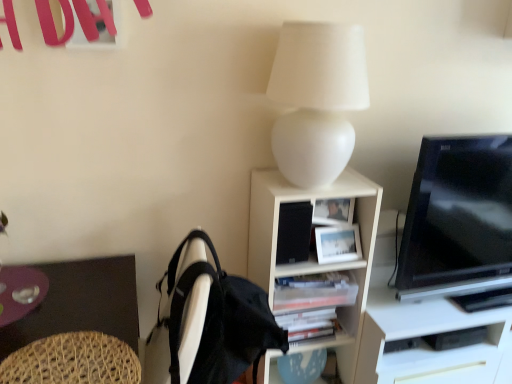
What do you see at coordinates (81, 303) in the screenshot?
I see `brown woven desk at lower left` at bounding box center [81, 303].

The width and height of the screenshot is (512, 384). What do you see at coordinates (218, 320) in the screenshot?
I see `black fabric backpack at lower left` at bounding box center [218, 320].

What do you see at coordinates (294, 232) in the screenshot? The height and width of the screenshot is (384, 512). I see `black matte speaker at center` at bounding box center [294, 232].

This screenshot has height=384, width=512. In order to click on transparent glass plate at lower left in this screenshot , I will do `click(20, 292)`.

This screenshot has width=512, height=384. Describe the element at coordinates (314, 253) in the screenshot. I see `white matte shelf at center` at that location.

Where is `brown woven desk at lower left`? The image size is (512, 384). brown woven desk at lower left is located at coordinates (81, 303).

Is black matte speaker at center at the left side of black fabric backpack at lower left?

No, black matte speaker at center is not to the left of black fabric backpack at lower left.

How different are the orientations of black matte speaker at center and black fabric backpack at lower left in degrees?

The angular difference between black matte speaker at center and black fabric backpack at lower left is 87.3 degrees.

Between black matte speaker at center and black fabric backpack at lower left, which one has larger width?

black fabric backpack at lower left is wider.

Is point (295, 212) closer or farther from the camera than point (276, 347)?

Point (295, 212) is positioned farther from the camera compared to point (276, 347).

From a real-world perspective, is white matte shelf at center located higher than black fabric backpack at lower left?

Actually, white matte shelf at center is physically below black fabric backpack at lower left in the real world.

Can you confirm if white matte shelf at center is shorter than black fabric backpack at lower left?

In fact, white matte shelf at center may be taller than black fabric backpack at lower left.

Looking at this image, considering the relative sizes of white matte shelf at center and black fabric backpack at lower left in the image provided, is white matte shelf at center wider than black fabric backpack at lower left?

No, white matte shelf at center is not wider than black fabric backpack at lower left.

The height and width of the screenshot is (384, 512). What are the coordinates of `shelf below the black fabric backpack at lower left (from a real-world perspective)` in the screenshot? It's located at (314, 253).

Is brown woven desk at lower left at the back of black fabric backpack at lower left?

Yes, brown woven desk at lower left is at the back of black fabric backpack at lower left.

Can you tell me how much black fabric backpack at lower left and brown woven desk at lower left differ in facing direction?

They differ by 86.5 degrees in their facing directions.

Is black fabric backpack at lower left far away from brown woven desk at lower left?

Actually, black fabric backpack at lower left and brown woven desk at lower left are a little close together.

Can you confirm if black fabric backpack at lower left is thinner than brown woven desk at lower left?

Yes, black fabric backpack at lower left is thinner than brown woven desk at lower left.

From a real-world perspective, which is physically below, transparent glass plate at lower left or black glossy tv at right?

transparent glass plate at lower left is physically lower.

Is transparent glass plate at lower left not close to black glossy tv at right?

Yes, transparent glass plate at lower left and black glossy tv at right are located far from each other.

Is transparent glass plate at lower left surrounding black glossy tv at right?

Definitely not — black glossy tv at right is not inside transparent glass plate at lower left.

How different are the orientations of transparent glass plate at lower left and black glossy tv at right in degrees?

transparent glass plate at lower left and black glossy tv at right are facing 1.37 degrees away from each other.

Choose the correct answer: Is brown woven desk at lower left inside woven wood swivel chair at lower left or outside it?

brown woven desk at lower left is outside woven wood swivel chair at lower left.

Considering the positions of points (2, 339) and (42, 339), is point (2, 339) closer to camera compared to point (42, 339)?

No, it is behind (42, 339).

From a real-world perspective, relative to woven wood swivel chair at lower left, is brown woven desk at lower left vertically above or below?

Clearly, from a real-world perspective, brown woven desk at lower left is below woven wood swivel chair at lower left.

Looking at this image, would you say brown woven desk at lower left is a long distance from woven wood swivel chair at lower left?

That's not correct — brown woven desk at lower left is a little close to woven wood swivel chair at lower left.

The image size is (512, 384). Identify the location of swivel chair that is under the black glossy tv at right (from a real-world perspective). (73, 361).

Which object is positioned more to the left, woven wood swivel chair at lower left or black glossy tv at right?

From the viewer's perspective, woven wood swivel chair at lower left appears more on the left side.

From a real-world perspective, which is physically below, woven wood swivel chair at lower left or black glossy tv at right?

woven wood swivel chair at lower left is physically lower.

From the image's perspective, is woven wood swivel chair at lower left on black fabric backpack at lower left?

Yes, from the image's perspective, woven wood swivel chair at lower left is on top of black fabric backpack at lower left.

Is the surface of woven wood swivel chair at lower left in direct contact with black fabric backpack at lower left?

No, woven wood swivel chair at lower left is not in contact with black fabric backpack at lower left.

Is the position of woven wood swivel chair at lower left less distant than that of black fabric backpack at lower left?

Yes, it is in front of black fabric backpack at lower left.

The width and height of the screenshot is (512, 384). What are the coordinates of `speaker behind the black fabric backpack at lower left` in the screenshot? It's located at tap(294, 232).

Where is `backpack lying on the left of white matte shelf at center`? backpack lying on the left of white matte shelf at center is located at coordinates (218, 320).

Looking at the image, which one is located further to black fabric backpack at lower left, transparent glass plate at lower left or black glossy tv at right?

Based on the image, black glossy tv at right appears to be further to black fabric backpack at lower left.

When comparing their distances from black glossy tv at right, does woven wood swivel chair at lower left or white matte shelf at center seem closer?

white matte shelf at center lies closer to black glossy tv at right than the other object.

Estimate the real-world distances between objects in this image. Which object is further from black glossy tv at right, black matte speaker at center or black fabric backpack at lower left?

black fabric backpack at lower left is positioned further to the anchor black glossy tv at right.

From the picture: Based on their spatial positions, is woven wood swivel chair at lower left or white matte shelf at center further from transparent glass plate at lower left?

white matte shelf at center lies further to transparent glass plate at lower left than the other object.

In the scene shown: When comparing their distances from brown woven desk at lower left, does white matte shelf at center or black fabric backpack at lower left seem closer?

black fabric backpack at lower left is positioned closer to the anchor brown woven desk at lower left.

Based on their spatial positions, is white matte shelf at center or woven wood swivel chair at lower left closer to black glossy tv at right?

white matte shelf at center is positioned closer to the anchor black glossy tv at right.

From the image, which object appears to be nearer to white matte shelf at center, transparent glass plate at lower left or black fabric backpack at lower left?

black fabric backpack at lower left lies closer to white matte shelf at center than the other object.

From the image, which object appears to be nearer to white matte shelf at center, brown woven desk at lower left or black fabric backpack at lower left?

black fabric backpack at lower left is positioned closer to the anchor white matte shelf at center.

The height and width of the screenshot is (384, 512). I want to click on speaker located between brown woven desk at lower left and white matte shelf at center in the left-right direction, so point(294,232).

Identify the location of backpack situated between brown woven desk at lower left and black glossy tv at right from left to right. The height and width of the screenshot is (384, 512). [x=218, y=320].

Locate an element on the screen. The width and height of the screenshot is (512, 384). shelf between white matte lamp at upper center and black fabric backpack at lower left vertically is located at coordinates (314, 253).

You are a GUI agent. You are given a task and a screenshot of the screen. Output one action in this format:
    pyautogui.click(x=<x>, y=<y>)
    Task: Click on the speaker situated between brown woven desk at lower left and black glossy tv at right from left to right
    This screenshot has height=384, width=512.
    Given the screenshot: What is the action you would take?
    click(x=294, y=232)